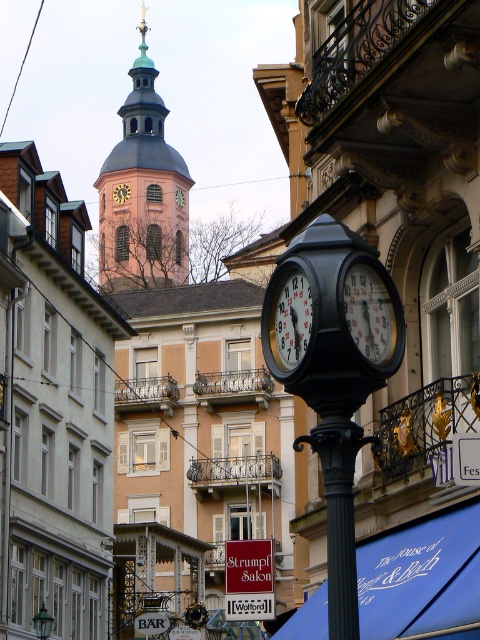
Question: Considering the relative positions of metallic clock at center and metallic clock face at center in the image provided, where is metallic clock at center located with respect to metallic clock face at center?

Choices:
 (A) above
 (B) below

Answer: (A)

Question: Does metallic clock face at center have a larger size compared to matte black clock at center?

Choices:
 (A) no
 (B) yes

Answer: (B)

Question: Which point is farther from the camera taking this photo?

Choices:
 (A) (156, 243)
 (B) (39, 612)
 (C) (361, 337)

Answer: (A)

Question: Which object is the farthest from the metallic clock at center?

Choices:
 (A) wooden clock at center
 (B) matte black clock at center

Answer: (B)

Question: Is metallic clock face at center wider than matte black clock at center?

Choices:
 (A) no
 (B) yes

Answer: (A)

Question: Which is farther from the pink stone clock tower at upper center?

Choices:
 (A) matte black clock at center
 (B) metallic clock face at center

Answer: (B)